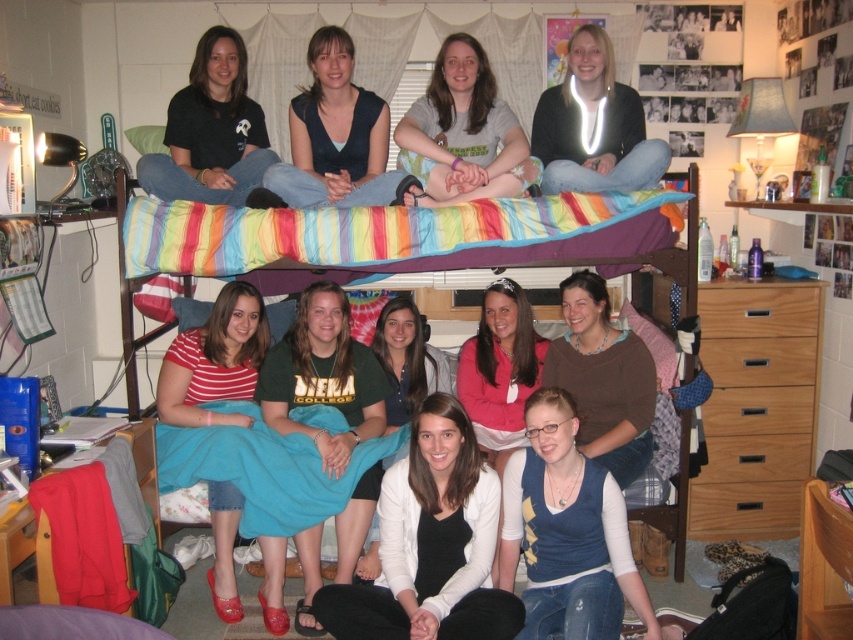
Does denim vest at lower center have a larger size compared to tie-dye fabric skirt at center?

Incorrect, denim vest at lower center is not larger than tie-dye fabric skirt at center.

Find the location of `denim vest at lower center`. denim vest at lower center is located at coordinates (566, 532).

Locate an element on the screen. denim vest at lower center is located at coordinates (566, 532).

Where is `denim vest at lower center`? This screenshot has height=640, width=853. denim vest at lower center is located at coordinates (566, 532).

Can you confirm if tie-dye fabric skirt at center is positioned to the right of brown soft shirt at center?

In fact, tie-dye fabric skirt at center is to the left of brown soft shirt at center.

Can you confirm if tie-dye fabric skirt at center is bigger than brown soft shirt at center?

Indeed, tie-dye fabric skirt at center has a larger size compared to brown soft shirt at center.

Locate an element on the screen. The width and height of the screenshot is (853, 640). tie-dye fabric skirt at center is located at coordinates (323, 376).

Based on the photo, is tie-dye fabric skirt at center positioned in front of white sweater at lower center?

That is True.

Is tie-dye fabric skirt at center shorter than white sweater at lower center?

No.

In order to click on tie-dye fabric skirt at center in this screenshot , I will do `click(323, 376)`.

You are a GUI agent. You are given a task and a screenshot of the screen. Output one action in this format:
    pyautogui.click(x=<x>, y=<y>)
    Task: Click on the tie-dye fabric skirt at center
    The image size is (853, 640).
    Given the screenshot: What is the action you would take?
    pyautogui.click(x=323, y=376)